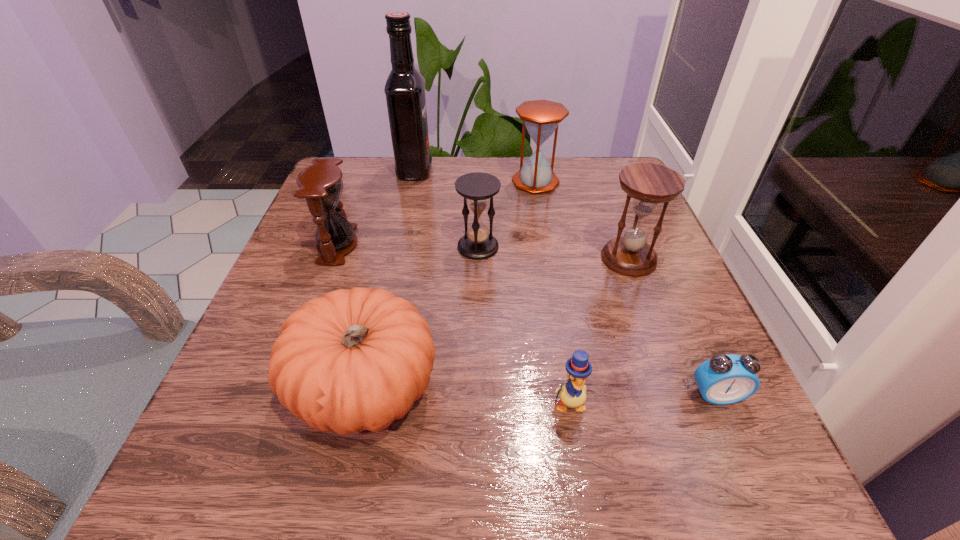
At what (x,y) coordinates should I click in order to perform the action: click on pumpkin at the left edge. Please return your answer as a coordinate pair (x, y). The height and width of the screenshot is (540, 960). Looking at the image, I should click on (351, 360).

Locate an element on the screen. hourglass present at the right edge is located at coordinates (648, 184).

Where is `alarm clock at the right edge`? alarm clock at the right edge is located at coordinates (724, 379).

Identify the location of object located in the near left corner section of the desktop. This screenshot has width=960, height=540. (351, 360).

At what (x,y) coordinates should I click in order to perform the action: click on vacant space at the far edge of the desktop. Please return your answer as a coordinate pair (x, y). Looking at the image, I should click on (452, 176).

Image resolution: width=960 pixels, height=540 pixels. In the image, there is a desktop. What are the coordinates of `vacant space at the near edge` in the screenshot? It's located at (611, 440).

Locate an element on the screen. The height and width of the screenshot is (540, 960). vacant space at the left edge of the desktop is located at coordinates (215, 416).

Where is `vacant space at the right edge of the desktop`? The image size is (960, 540). vacant space at the right edge of the desktop is located at coordinates (633, 376).

You are a GUI agent. You are given a task and a screenshot of the screen. Output one action in this format:
    pyautogui.click(x=<x>, y=<y>)
    Task: Click on the free spot at the far left corner of the desktop
    
    Given the screenshot: What is the action you would take?
    pyautogui.click(x=367, y=157)

You are a GUI agent. You are given a task and a screenshot of the screen. Output one action in this format:
    pyautogui.click(x=<x>, y=<y>)
    Task: Click on the vacant region at the near left corner of the desktop
    
    Given the screenshot: What is the action you would take?
    pyautogui.click(x=283, y=488)